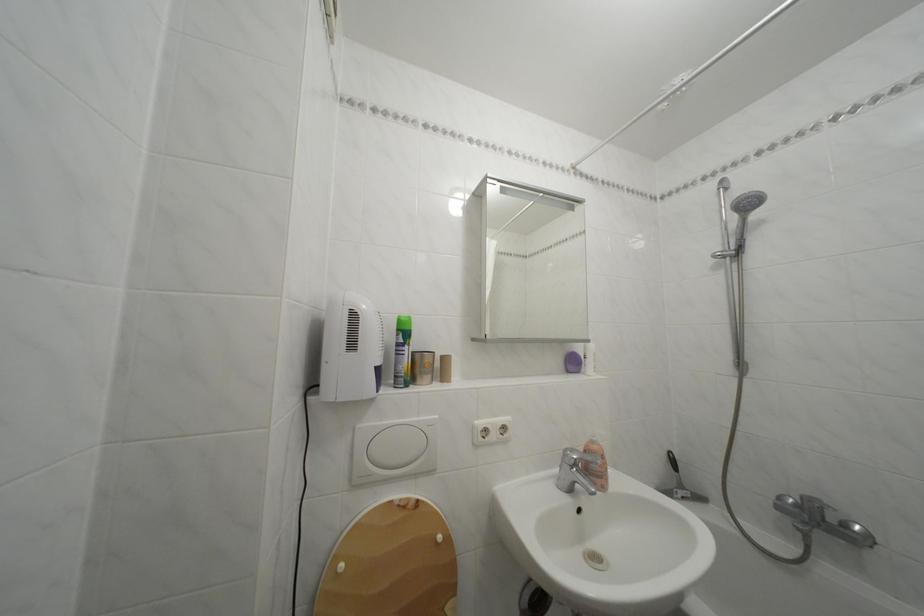
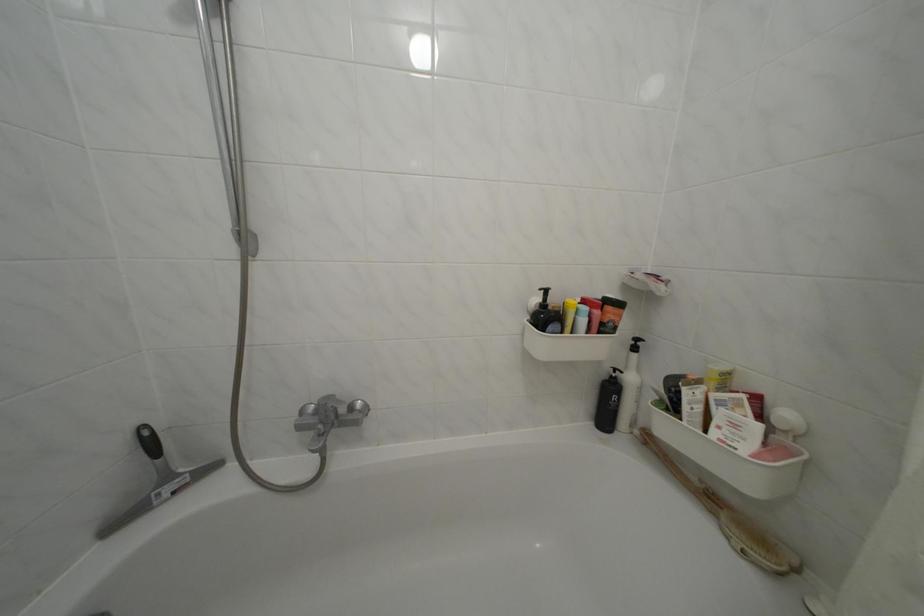
Question: Based on the continuous images, in which direction is the camera rotating? Reply with the corresponding letter.

Choices:
 (A) Left
 (B) Right
 (C) Up
 (D) Down

Answer: (B)